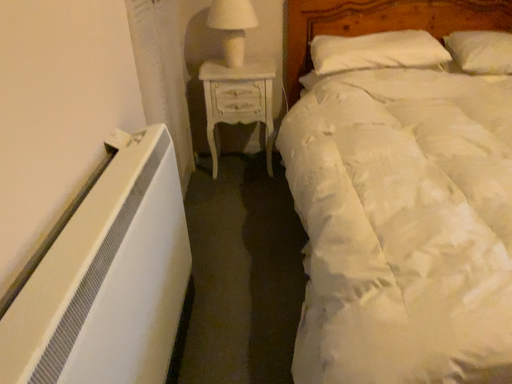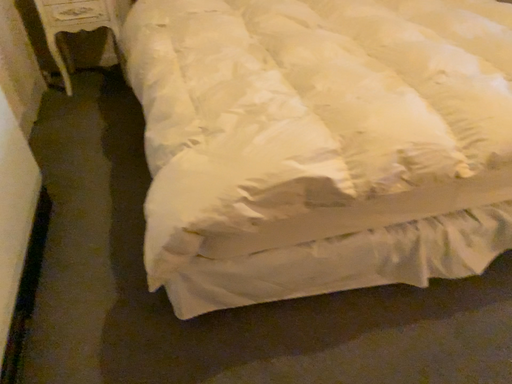
Question: Which way did the camera rotate in the video?

Choices:
 (A) rotated downward
 (B) rotated upward

Answer: (A)